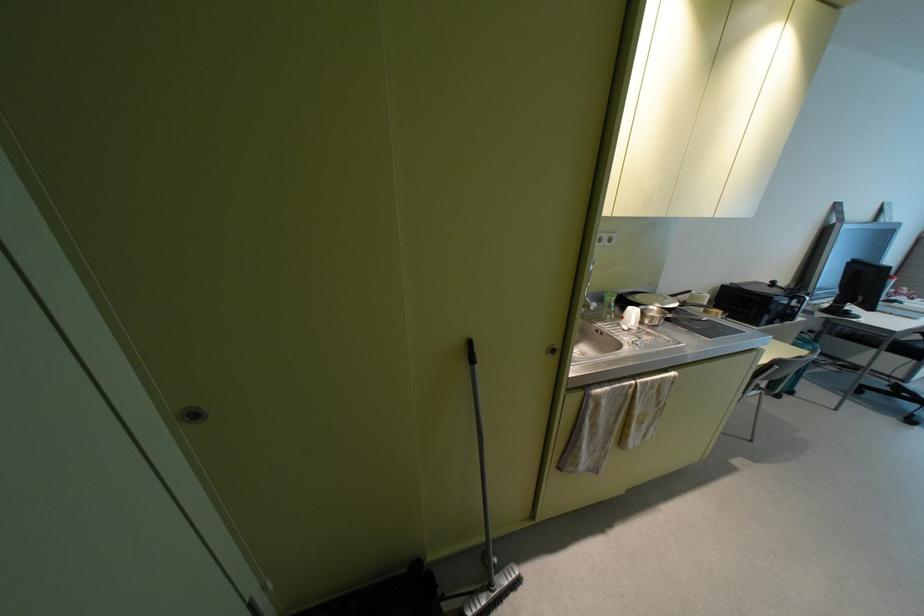
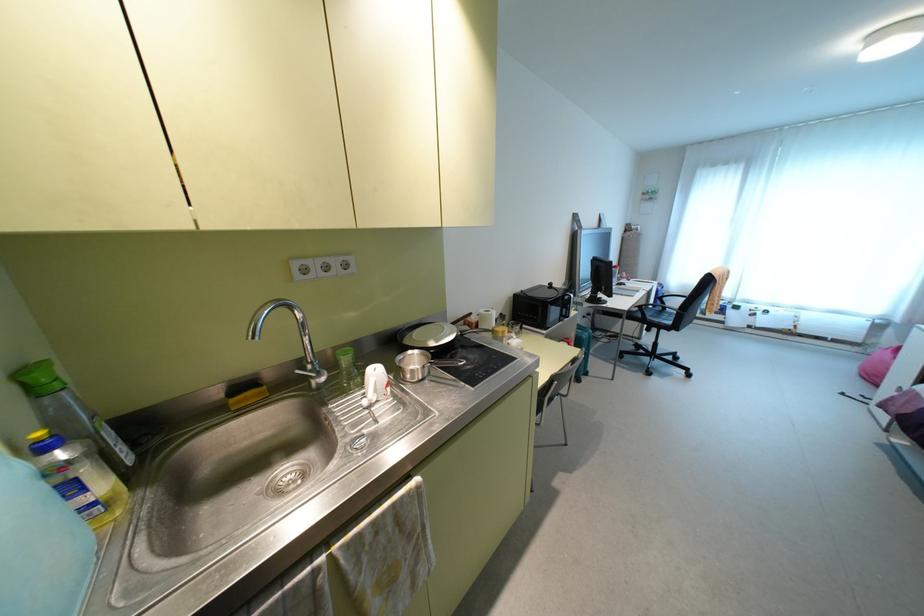
Where in the second image is the point corresponding to (798,318) from the first image?

(573, 313)